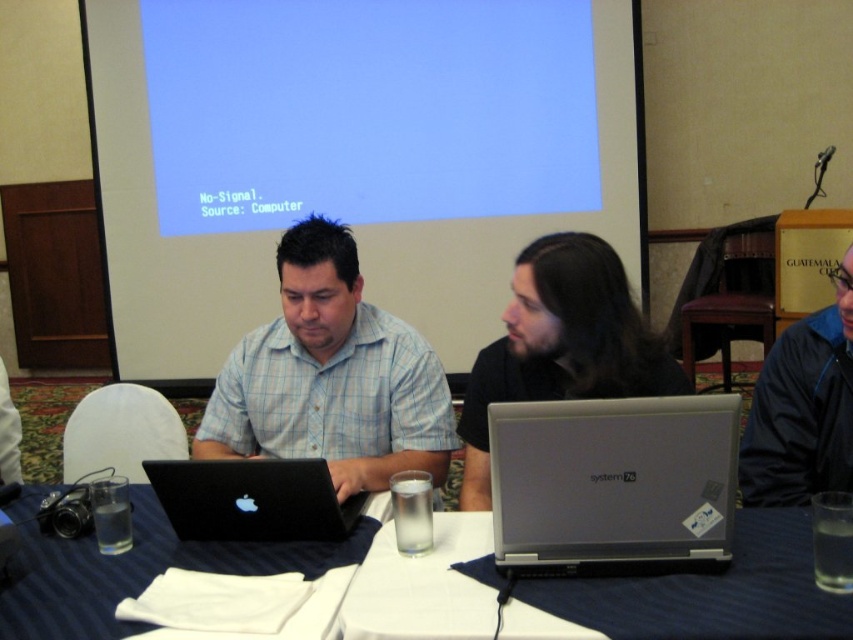
Question: Which of the following is the farthest from the observer?

Choices:
 (A) black matte hair at center
 (B) silver metallic laptop at center
 (C) matte black shirt at center

Answer: (C)

Question: Which point is farther to the camera?

Choices:
 (A) (200, 134)
 (B) (254, 458)
 (C) (376, 436)

Answer: (A)

Question: Does blue matte projection screen at upper center appear under blue fabric table at center?

Choices:
 (A) no
 (B) yes

Answer: (A)

Question: Considering the real-world distances, which object is closest to the black matte hair at center?

Choices:
 (A) silver metallic laptop at center
 (B) blue matte projection screen at upper center

Answer: (A)

Question: Is silver metallic laptop at center to the right of black matte hair at center from the viewer's perspective?

Choices:
 (A) yes
 (B) no

Answer: (A)

Question: Can you confirm if silver metallic laptop at center is wider than blue fleece jacket at right?

Choices:
 (A) no
 (B) yes

Answer: (B)